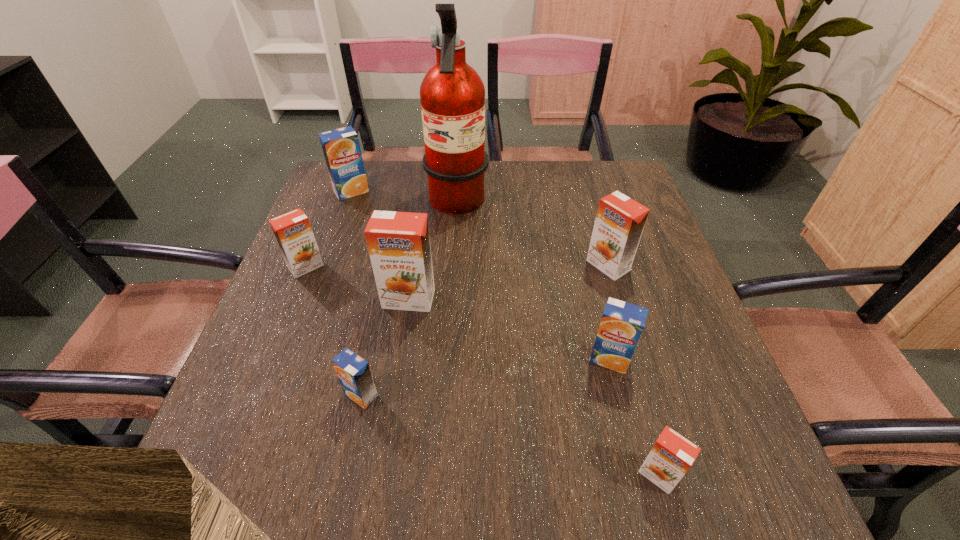
Locate an element on the screen. the tallest object is located at coordinates (452, 94).

Locate an element on the screen. This screenshot has height=540, width=960. the third orange orange juice from right to left is located at coordinates (398, 243).

In order to click on the fifth farthest object in this screenshot , I will do `click(398, 243)`.

What are the coordinates of `the farthest orange juice` in the screenshot? It's located at [x=341, y=148].

Image resolution: width=960 pixels, height=540 pixels. I want to click on the leftmost blue orange_juice, so click(x=341, y=148).

This screenshot has height=540, width=960. What are the coordinates of `the second biggest orange orange juice` in the screenshot? It's located at (620, 220).

Image resolution: width=960 pixels, height=540 pixels. I want to click on the leftmost orange orange juice, so click(293, 232).

You are a GUI agent. You are given a task and a screenshot of the screen. Output one action in this format:
    pyautogui.click(x=<x>, y=<y>)
    Task: Click on the sixth farthest object
    
    Given the screenshot: What is the action you would take?
    tap(622, 323)

Image resolution: width=960 pixels, height=540 pixels. I want to click on the second farthest blue orange_juice, so click(x=622, y=323).

Image resolution: width=960 pixels, height=540 pixels. Find the location of `the nearest blue orange_juice`. the nearest blue orange_juice is located at coordinates (354, 374).